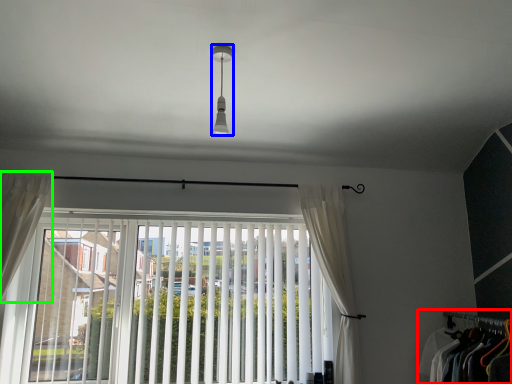
Question: Considering the real-world distances, which object is farthest from closet (highlighted by a red box)? light fixture (highlighted by a blue box) or curtain (highlighted by a green box)?

Choices:
 (A) light fixture
 (B) curtain

Answer: (B)